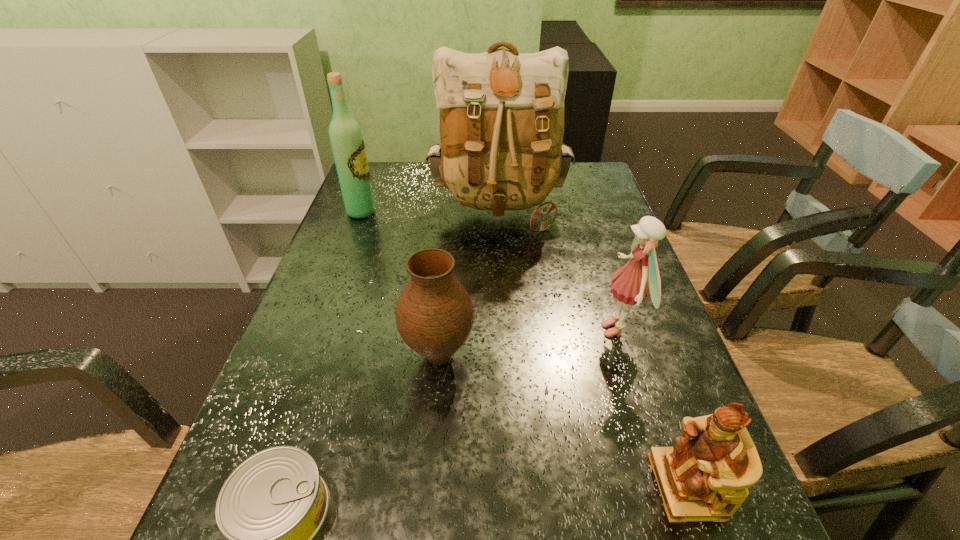
This screenshot has width=960, height=540. Identify the location of vacant space in between the wine bottle and the second shortest object. (524, 349).

Find the location of a particular element. The image size is (960, 540). free space between the vase and the tallest object is located at coordinates (468, 284).

Identify which object is the closest to the wine bottle. Please provide its 2D coordinates. Your answer should be formatted as a tuple, i.e. [(x, y)], where the tuple contains the x and y coordinates of a point satisfying the conditions above.

[(501, 113)]

Identify the location of the second closest object to the backpack. (640, 276).

This screenshot has height=540, width=960. Identify the location of vacant space that satisfies the following two spatial constraints: 1. on the front-facing side of the fifth shortest object; 2. on the left side of the vase. (308, 356).

This screenshot has width=960, height=540. I want to click on vacant area that satisfies the following two spatial constraints: 1. on the front-facing side of the vase; 2. on the left side of the wine bottle, so click(308, 356).

Identify the location of vacant area in the image that satisfies the following two spatial constraints: 1. on the front-facing side of the wine bottle; 2. on the back side of the vase. The height and width of the screenshot is (540, 960). (308, 356).

Locate an element on the screen. This screenshot has width=960, height=540. vacant area in the image that satisfies the following two spatial constraints: 1. on the front-facing side of the fourth tallest object; 2. on the right side of the wine bottle is located at coordinates (308, 356).